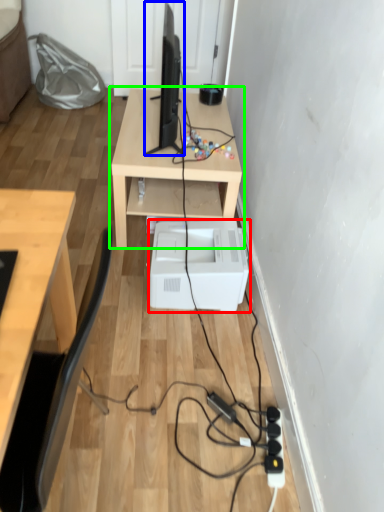
Question: Which is nearer to the printer (highlighted by a red box)? desktop computer (highlighted by a blue box) or table (highlighted by a green box).

Choices:
 (A) desktop computer
 (B) table

Answer: (B)